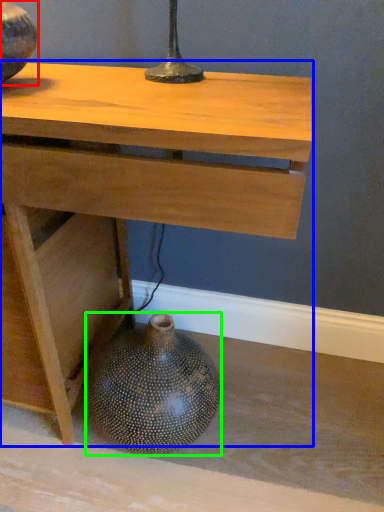
Question: Which object is positioned closest to vase (highlighted by a red box)? Select from table (highlighted by a blue box) and vase (highlighted by a green box).

Choices:
 (A) table
 (B) vase

Answer: (A)